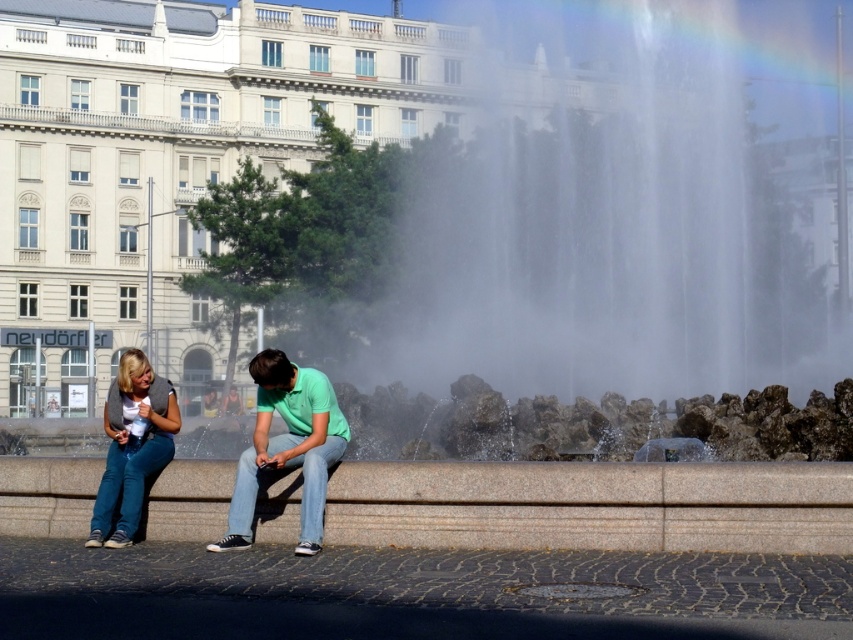
Between denim jeans at center and denim jeans at lower left, which one appears on the left side from the viewer's perspective?

From the viewer's perspective, denim jeans at lower left appears more on the left side.

From the picture: Is denim jeans at center to the right of denim jeans at lower left from the viewer's perspective?

Yes, denim jeans at center is to the right of denim jeans at lower left.

Describe the element at coordinates (131, 452) in the screenshot. I see `denim jeans at center` at that location.

This screenshot has height=640, width=853. In order to click on denim jeans at center in this screenshot , I will do `click(131, 452)`.